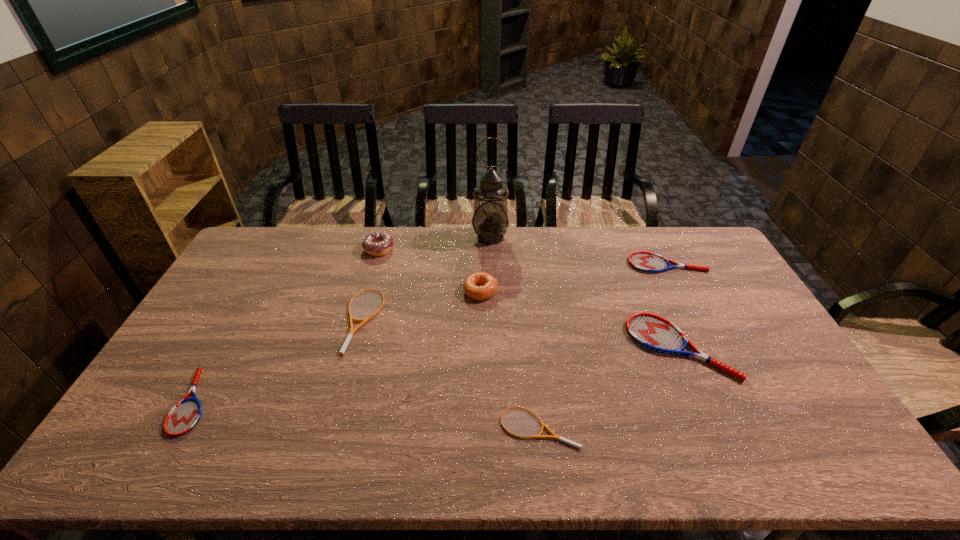
This screenshot has width=960, height=540. In the image, there is a desktop. What are the coordinates of `vacant space at the near edge` in the screenshot? It's located at (564, 455).

Locate an element on the screen. Image resolution: width=960 pixels, height=540 pixels. vacant space at the left edge of the desktop is located at coordinates (237, 294).

This screenshot has width=960, height=540. What are the coordinates of `free space at the far right corner` in the screenshot? It's located at (715, 266).

Locate an element on the screen. The image size is (960, 540). vacant region between the nearer beige tennis racket and the smallest blue tennis racket is located at coordinates (366, 414).

Locate an element on the screen. empty space between the left beige tennis racket and the leftmost blue tennis racket is located at coordinates (278, 361).

Find the location of a particular element. The width and height of the screenshot is (960, 540). vacant area that lies between the left doughnut and the nearer doughnut is located at coordinates (430, 270).

What are the coordinates of `vacant area that lies between the fourth tennis racket from right to left and the tan doughnut` in the screenshot? It's located at (421, 306).

Where is `free spot between the third tennis racket from right to left and the farthest tennis racket`? Image resolution: width=960 pixels, height=540 pixels. free spot between the third tennis racket from right to left and the farthest tennis racket is located at coordinates (602, 345).

The image size is (960, 540). Find the location of `vacant area that lies between the farthest blue tennis racket and the fourth tennis racket from right to left`. vacant area that lies between the farthest blue tennis racket and the fourth tennis racket from right to left is located at coordinates (515, 293).

Image resolution: width=960 pixels, height=540 pixels. Find the location of `free space between the left beige tennis racket and the left doughnut`. free space between the left beige tennis racket and the left doughnut is located at coordinates (372, 285).